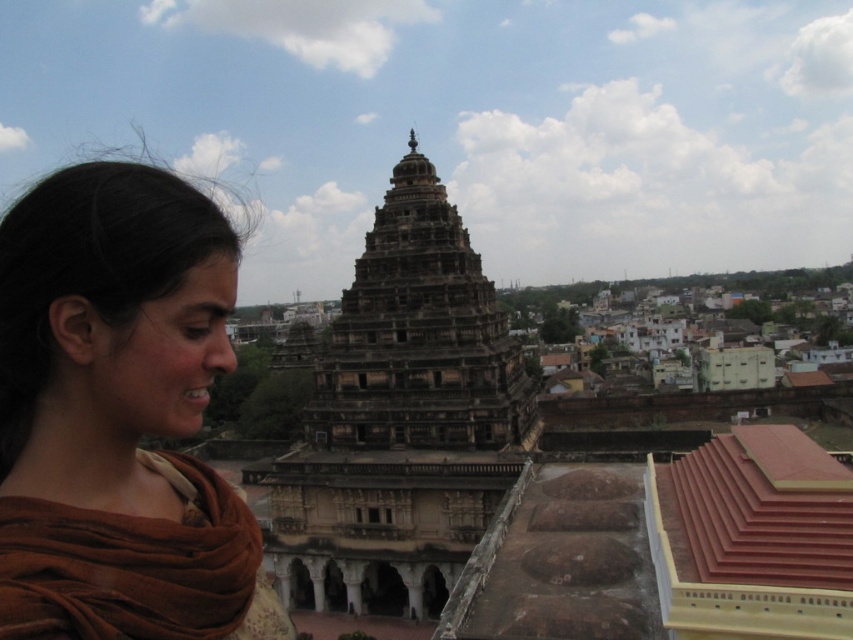
You are standing at the entrance of the temple complex and want to reach the point marked as point (x=115, y=346). If your walking speed is 1.5 meters per second, how many seconds will it take you to reach that point?

The point (x=115, y=346) is 33.67 meters away from the viewer. At a walking speed of 1.5 meters per second, it will take approximately 22.45 seconds to reach the point.

You are a tourist visiting the temple complex and want to take a photo that includes both the brown fabric at left and the dark brown stone tower at center. Considering their heights, which object will appear smaller in the photo?

The brown fabric at left will appear smaller in the photo because it has a lesser height compared to the dark brown stone tower at center.